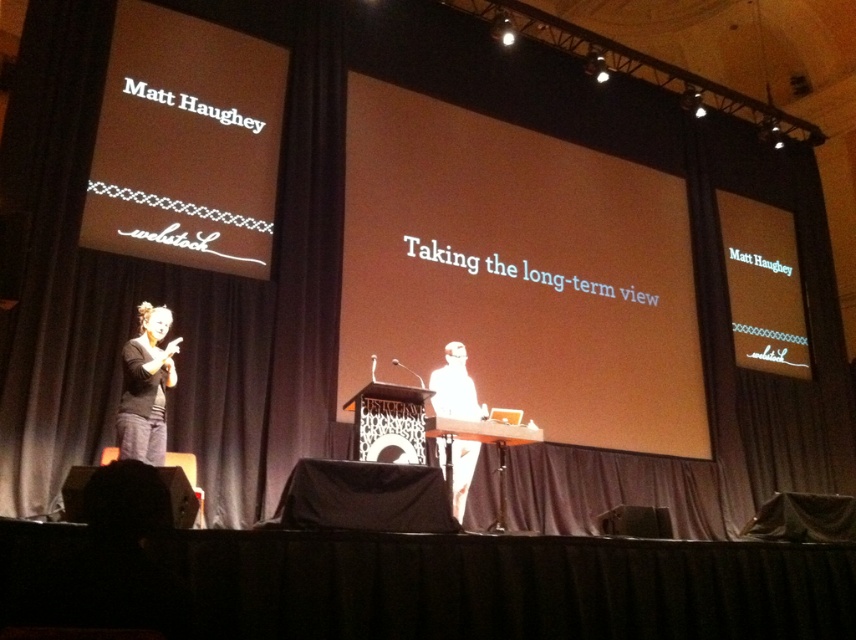
You are an event organizer who needs to place a 2.5 meter long banner between the black soft fabric at left and the white paper at center. Can you fit it there?

The distance between the black soft fabric at left and the white paper at center is 2.74 meters, so a 2.5 meter long banner can fit between them since it is shorter than the available space.

You are an event organizer who needs to place a 5 feet wide banner between the dark gray curtain at left and the white paper at center. Will the banner fit without overlapping either object?

The dark gray curtain at left and white paper at center are 5.15 feet apart, so a 5 feet wide banner can fit between them without overlapping either object since the space is slightly larger than the banner.